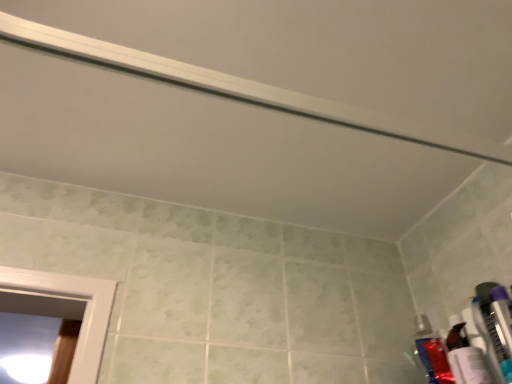
Question: Does translucent plastic toothbrush at lower right, which appears as the 2th toiletry when viewed from the front, have a lesser height compared to matte plastic toothpaste tube at right, which is counted as the fourth toiletry, starting from the front?

Choices:
 (A) no
 (B) yes

Answer: (B)

Question: Does translucent plastic toothbrush at lower right, which is counted as the third toiletry, starting from the back, have a lesser width compared to matte plastic toothpaste tube at right, which is counted as the fourth toiletry, starting from the front?

Choices:
 (A) no
 (B) yes

Answer: (B)

Question: Can you confirm if translucent plastic toothbrush at lower right, which appears as the 2th toiletry when viewed from the front, is positioned to the left of matte plastic toothpaste tube at right, the 1th toiletry viewed from the back?

Choices:
 (A) no
 (B) yes

Answer: (A)

Question: Is translucent plastic toothbrush at lower right, which is counted as the third toiletry, starting from the back, to the right of matte plastic toothpaste tube at right, the 1th toiletry viewed from the back, from the viewer's perspective?

Choices:
 (A) yes
 (B) no

Answer: (A)

Question: From a real-world perspective, does translucent plastic toothbrush at lower right, which appears as the 2th toiletry when viewed from the front, stand above matte plastic toothpaste tube at right, the 1th toiletry viewed from the back?

Choices:
 (A) no
 (B) yes

Answer: (A)

Question: Considering the positions of point (415, 322) and point (486, 339), is point (415, 322) closer or farther from the camera than point (486, 339)?

Choices:
 (A) closer
 (B) farther

Answer: (B)

Question: Based on their sizes in the image, would you say matte plastic toothpaste tube at right, the 1th toiletry viewed from the back, is bigger or smaller than translucent plastic toothpaste tube at lower right, acting as the 3th toiletry starting from the front?

Choices:
 (A) small
 (B) big

Answer: (A)

Question: Is matte plastic toothpaste tube at right, the 1th toiletry viewed from the back, inside or outside of translucent plastic toothpaste tube at lower right, acting as the 3th toiletry starting from the front?

Choices:
 (A) inside
 (B) outside

Answer: (B)

Question: Is matte plastic toothpaste tube at right, which is counted as the fourth toiletry, starting from the front, wider or thinner than translucent plastic toothpaste tube at lower right, acting as the 3th toiletry starting from the front?

Choices:
 (A) thin
 (B) wide

Answer: (A)

Question: From a real-world perspective, is matte plastic toothpaste tube at right, the 1th toiletry viewed from the back, above or below translucent plastic toothbrush at lower right, which is counted as the third toiletry, starting from the back?

Choices:
 (A) below
 (B) above

Answer: (B)

Question: Is matte plastic toothpaste tube at right, the 1th toiletry viewed from the back, to the left or to the right of translucent plastic toothbrush at lower right, which is counted as the third toiletry, starting from the back, in the image?

Choices:
 (A) right
 (B) left

Answer: (B)

Question: Does point (437, 344) appear closer or farther from the camera than point (486, 317)?

Choices:
 (A) closer
 (B) farther

Answer: (B)

Question: Considering the positions of matte plastic toothpaste tube at right, the 1th toiletry viewed from the back, and translucent plastic toothbrush at lower right, which appears as the 2th toiletry when viewed from the front, in the image, is matte plastic toothpaste tube at right, the 1th toiletry viewed from the back, bigger or smaller than translucent plastic toothbrush at lower right, which appears as the 2th toiletry when viewed from the front,?

Choices:
 (A) small
 (B) big

Answer: (B)

Question: Based on their positions, is translucent plastic toothbrush at lower right, which appears as the 2th toiletry when viewed from the front, located to the left or right of translucent plastic toothpaste tube at lower right, which is counted as the 2th toiletry, starting from the back?

Choices:
 (A) right
 (B) left

Answer: (A)

Question: Does point (508, 311) appear closer or farther from the camera than point (474, 319)?

Choices:
 (A) closer
 (B) farther

Answer: (A)